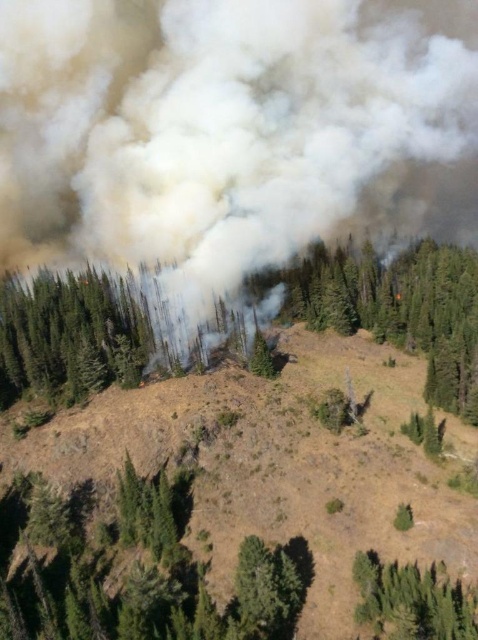
You are a firefighter assessing the wildfire scene from above. You notice the white smoke at center and the green leafy tree at lower right. How far apart are these two landmarks?

The white smoke at center and the green leafy tree at lower right are 364.03 feet apart.